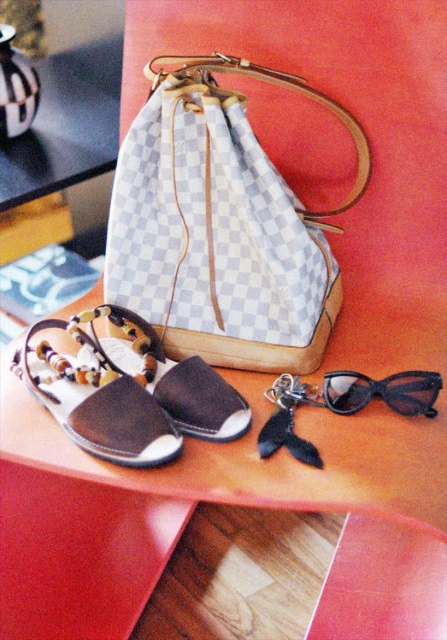
You are organizing a small display on a table and need to place the white checkered fabric handbag at center and the brown suede sandal at lower left. If the table has limited space, which item should you prioritize keeping to save space?

The brown suede sandal at lower left should be prioritized for keeping since it is smaller than the white checkered fabric handbag at center, allowing more space for other items.

You are organizing a fashion photoshoot and need to position the white checkered fabric handbag at center precisely. According to the coordinates provided, what are the exact coordinates where the handbag should be placed?

The white checkered fabric handbag at center should be placed at coordinates point (x=222, y=227).